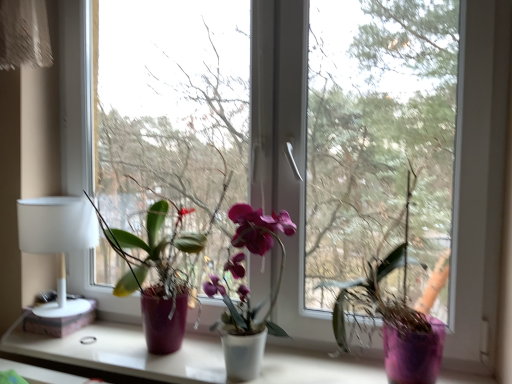
Question: Is transparent glass window at center, which is counted as the 1th window screen, starting from the right, inside the boundaries of white matte window sill at center, or outside?

Choices:
 (A) outside
 (B) inside

Answer: (A)

Question: Looking at the image, does transparent glass window at center, which is counted as the 1th window screen, starting from the right, seem bigger or smaller compared to white matte window sill at center?

Choices:
 (A) big
 (B) small

Answer: (A)

Question: Based on their relative distances, which object is nearer to the matte purple pot at left, the 1th houseplant from the left?

Choices:
 (A) transparent glass window at center, which is counted as the 1th window screen, starting from the left
 (B) transparent glass window at center, which is counted as the 1th window screen, starting from the right
 (C) white matte table lamp at left
 (D) transparent glass window at center
 (E) white matte window sill at center

Answer: (C)

Question: Estimate the real-world distances between objects in this image. Which object is closer to the transparent glass window at center?

Choices:
 (A) transparent glass window at center, which is counted as the 1th window screen, starting from the left
 (B) purple matte vase at center, placed as the 1th houseplant when sorted from right to left
 (C) white matte window sill at center
 (D) matte purple pot at left, the third houseplant positioned from the right
 (E) matte purple orchid at center, positioned as the second houseplant in left-to-right order

Answer: (A)